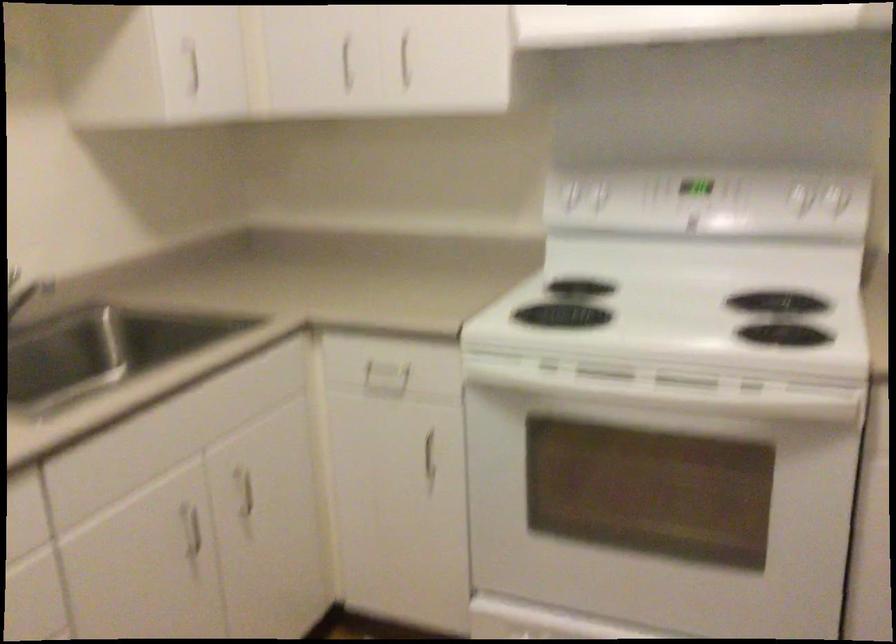
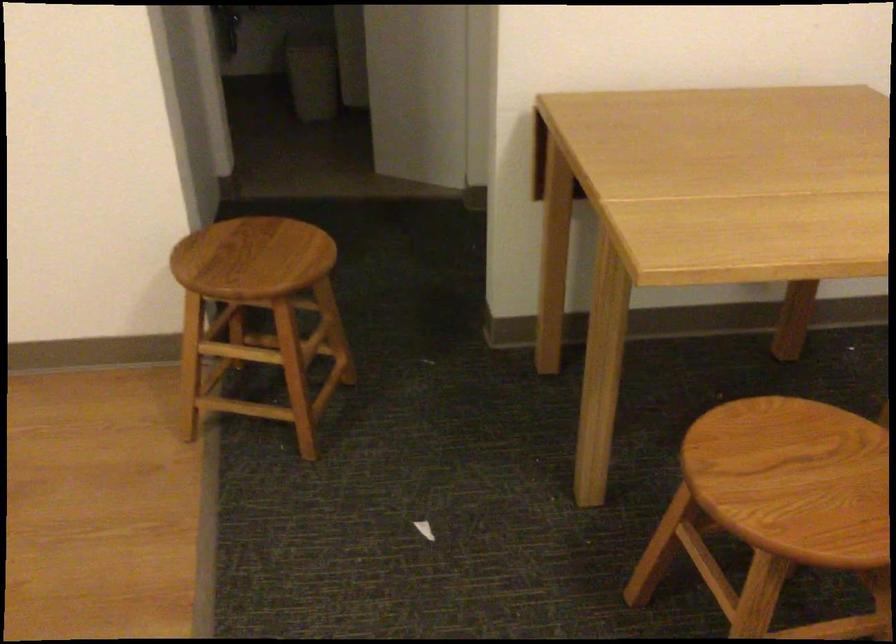
First-person continuous shooting, in which direction is the camera rotating?

The camera rotated toward right-down.